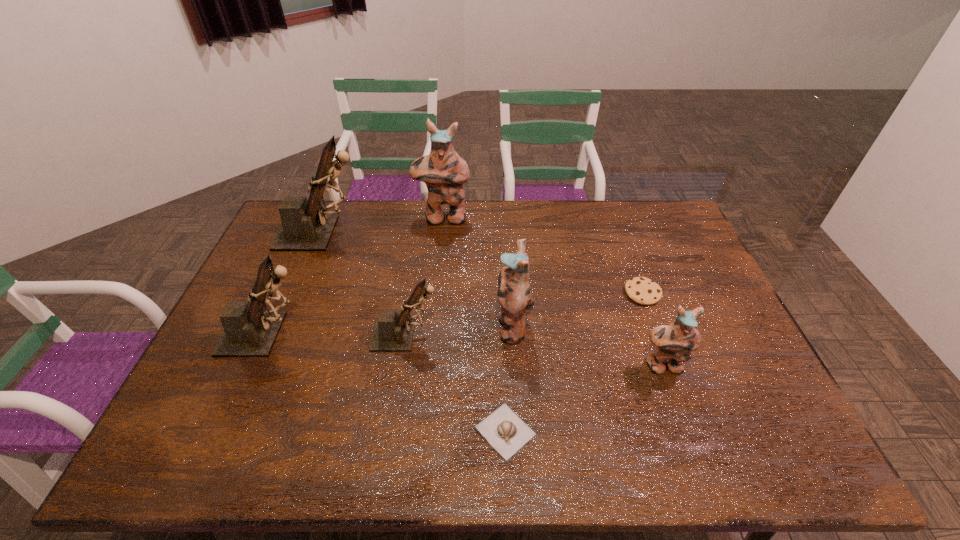
Find the location of a particular element. This screenshot has width=960, height=540. free spot located 0.090m on the front-facing side of the nearest pink figurine is located at coordinates (678, 409).

What are the coordinates of `free spot located on the front of the seventh tallest object` in the screenshot? It's located at (654, 325).

The image size is (960, 540). Identify the location of free spot located 0.360m on the right of the nearest object. (691, 431).

You are a GUI agent. You are given a task and a screenshot of the screen. Output one action in this format:
    pyautogui.click(x=<x>, y=<y>)
    Task: Click on the object positioned at the near edge
    
    Given the screenshot: What is the action you would take?
    pyautogui.click(x=503, y=429)

Where is `object located at the far left corner`? object located at the far left corner is located at coordinates (305, 226).

The image size is (960, 540). What are the coordinates of `blank area at the far edge` in the screenshot? It's located at (444, 240).

Image resolution: width=960 pixels, height=540 pixels. I want to click on free space at the left edge of the desktop, so click(x=212, y=359).

In the image, there is a desktop. Where is `free region at the right edge`? free region at the right edge is located at coordinates (675, 292).

In the image, there is a desktop. Identify the location of vacant space at the far right corner. (677, 222).

Locate an element on the screen. empty space that is in between the biggest pink figurine and the biggest brown figurine is located at coordinates (383, 226).